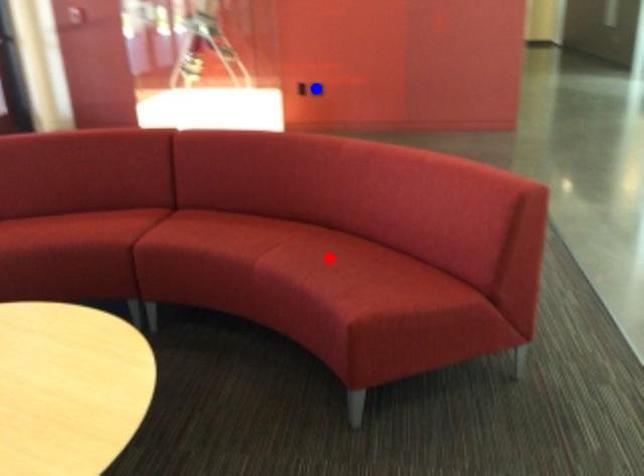
Question: Two points are marked on the image. Which point is closer to the camera?

Choices:
 (A) Blue point is closer.
 (B) Red point is closer.

Answer: (B)